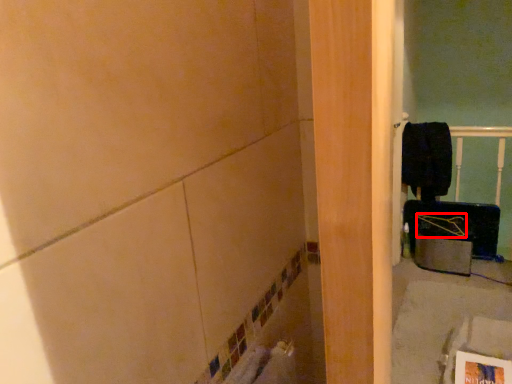
Question: Where is job (annotated by the red box) located in relation to laundry in the image?

Choices:
 (A) right
 (B) left

Answer: (A)